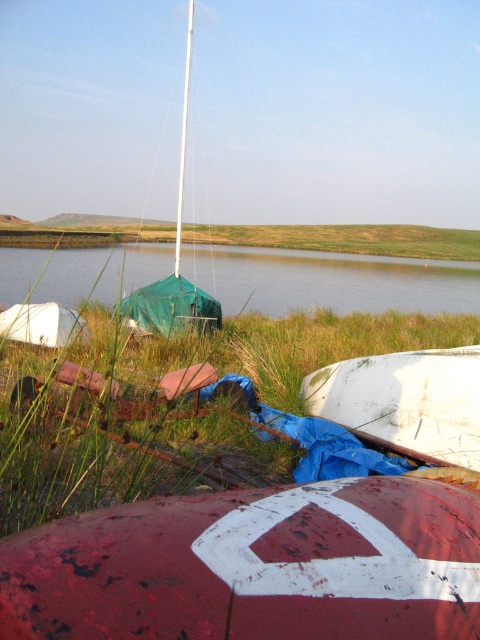
Is point (81, 564) farther from viewer compared to point (12, 387)?

No, it is in front of (12, 387).

Is red painted buoy at center smaller than green grass at center?

Indeed, red painted buoy at center has a smaller size compared to green grass at center.

Is point (241, 627) closer to camera compared to point (239, 445)?

That is True.

At what (x,y) coordinates should I click in order to perform the action: click on red painted buoy at center. Please return your answer as a coordinate pair (x, y). This screenshot has width=480, height=640. Looking at the image, I should click on (253, 566).

Is point (356, 332) more distant than point (241, 252)?

No.

Which is behind, point (283, 369) or point (241, 292)?

The point (241, 292) is behind.

Is point (380, 316) in front of point (333, 257)?

Yes.

Identify the location of green grass at center. The width and height of the screenshot is (480, 640). (244, 374).

Who is higher up, red painted buoy at center or green fabric water at center?

Positioned higher is green fabric water at center.

Where is `red painted buoy at center`? Image resolution: width=480 pixels, height=640 pixels. red painted buoy at center is located at coordinates (253, 566).